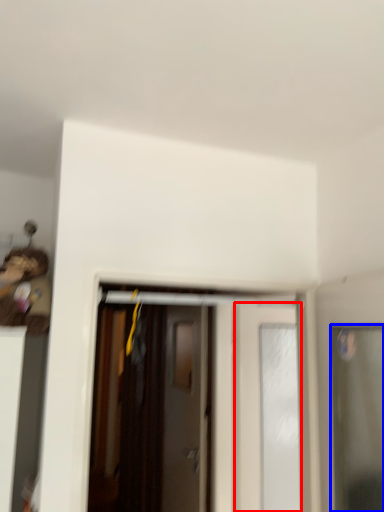
Question: Which of the following is the closest to the observer, door (highlighted by a red box) or door (highlighted by a blue box)?

Choices:
 (A) door
 (B) door

Answer: (B)